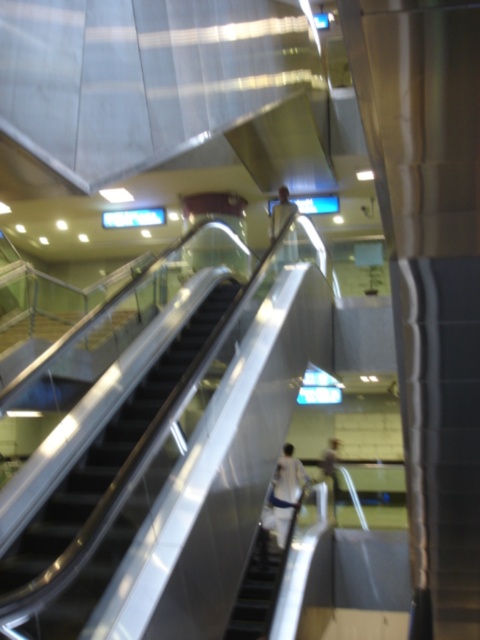
You are standing at the base of the escalators in the transportation hub. There is a point marked at coordinates [71,534]. Can you reach this point by walking forward without moving sideways?

The point at [71,534] is 5.06 meters away from you. Since you can walk forward in a straight line, you can reach it without moving sideways.

You are standing at the bottom of the escalators in the transportation hub. You notice a white fabric at center and a light brown leather jacket at center. Which item is wider?

The white fabric at center is wider than the light brown leather jacket at center according to the description.